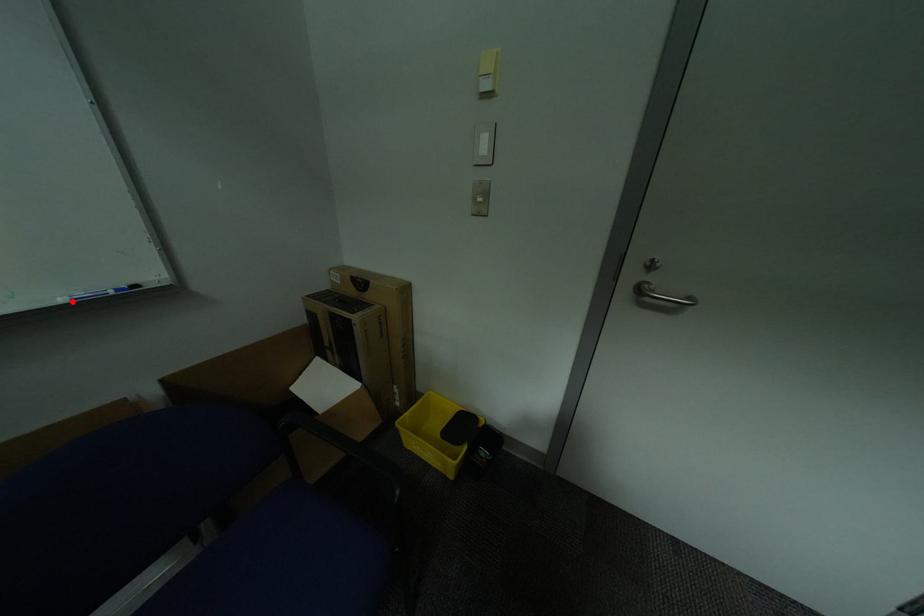
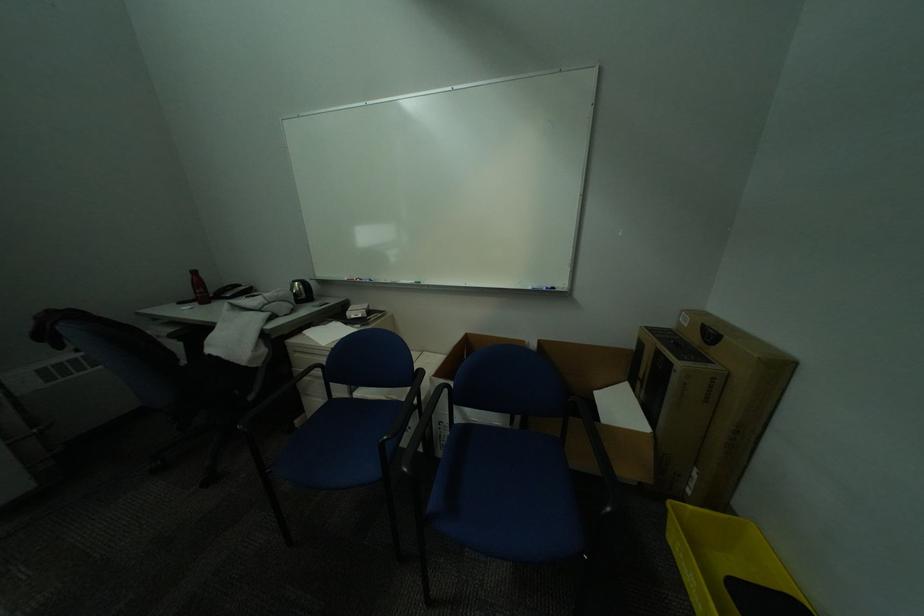
In the second image, find the point that corresponds to the highlighted location in the first image.

(541, 289)